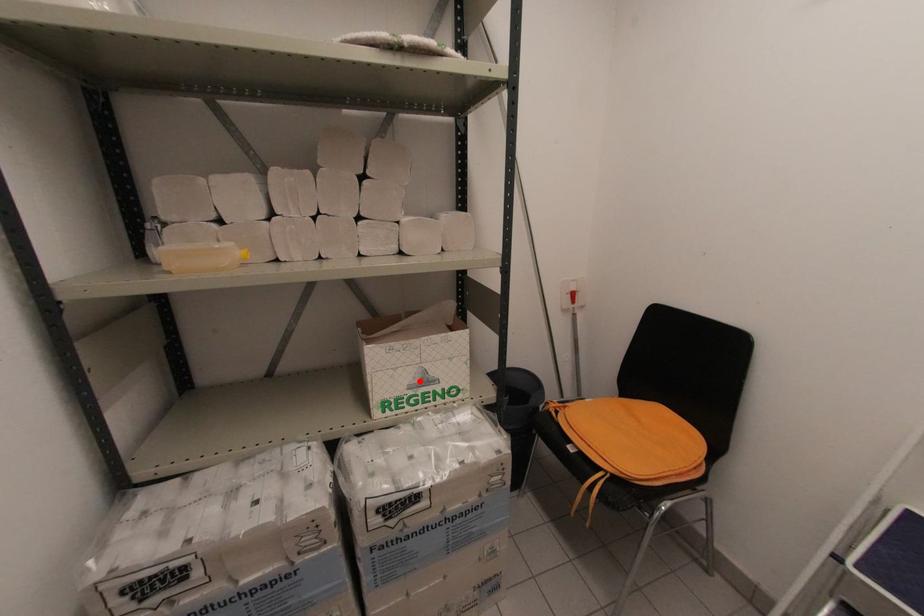
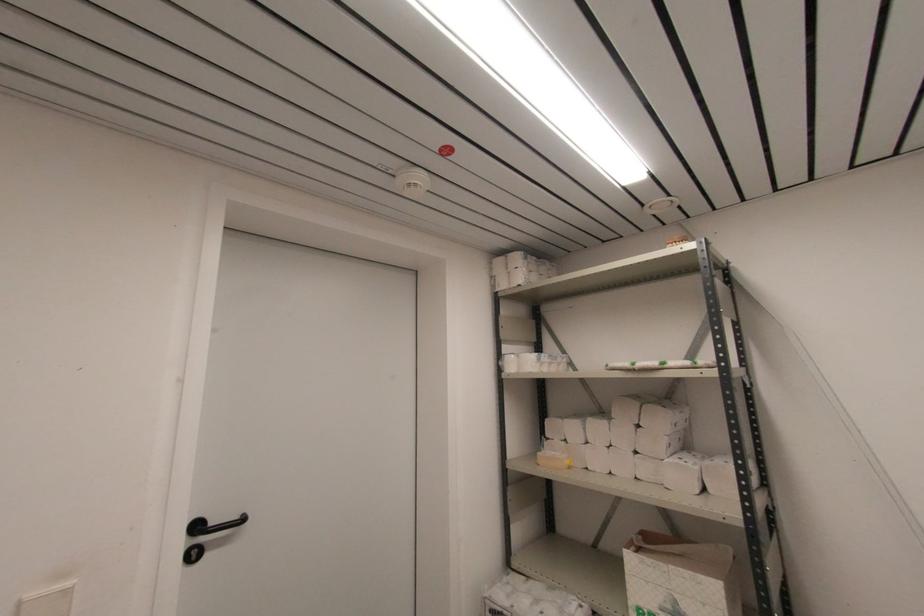
Question: I am providing you with two images of the same scene from different viewpoints. In image1, a red point is highlighted. Considering the same 3D point in image2, which of the following is correct?

Choices:
 (A) It is closer
 (B) It is farther

Answer: (A)